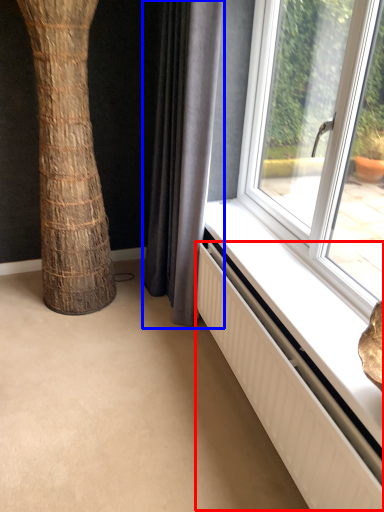
Question: Which of the following is the closest to the observer, radiator (highlighted by a red box) or curtain (highlighted by a blue box)?

Choices:
 (A) radiator
 (B) curtain

Answer: (A)